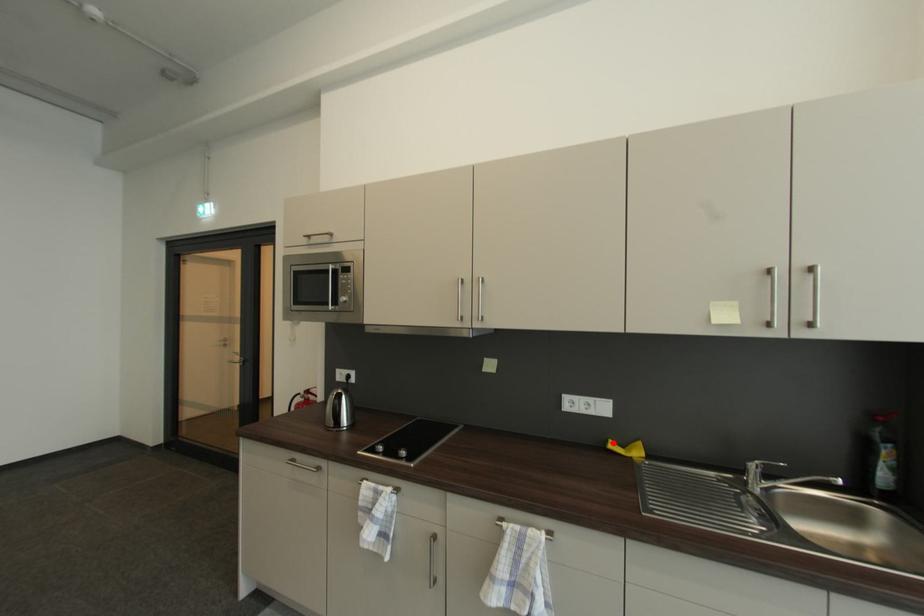
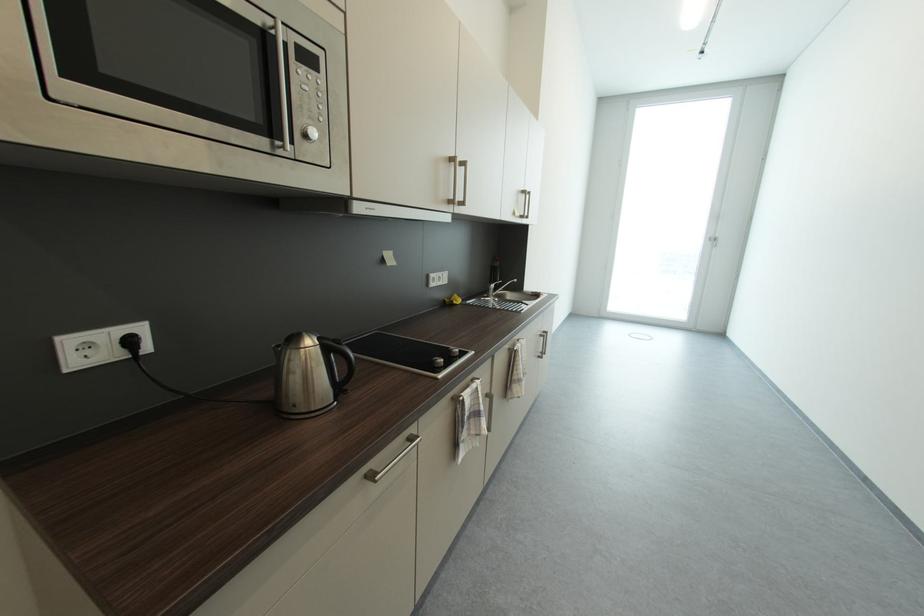
Question: I am providing you with two images of the same scene from different viewpoints. Given a red point in image1, look at the same physical point in image2. Is it:

Choices:
 (A) Closer to the viewpoint
 (B) Farther from the viewpoint

Answer: (A)